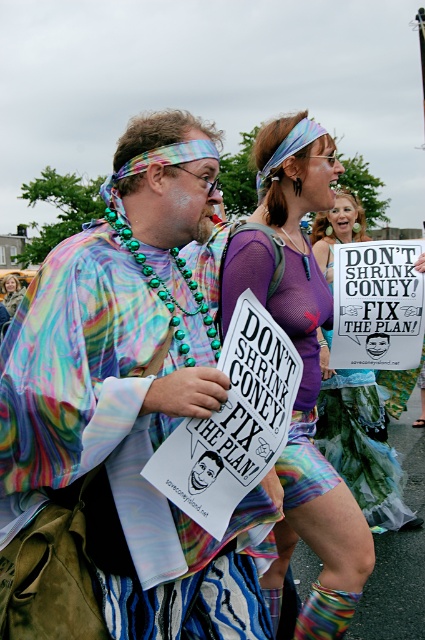
You are a photographer trying to capture the protest scene. You notice the matte purple mesh top at center and the rainbow fabric scarf at upper left. Which object should you focus on first to ensure it appears larger in your photo?

The matte purple mesh top at center is closer to the viewer than the rainbow fabric scarf at upper left, so focusing on it first will make it appear larger in the photo.